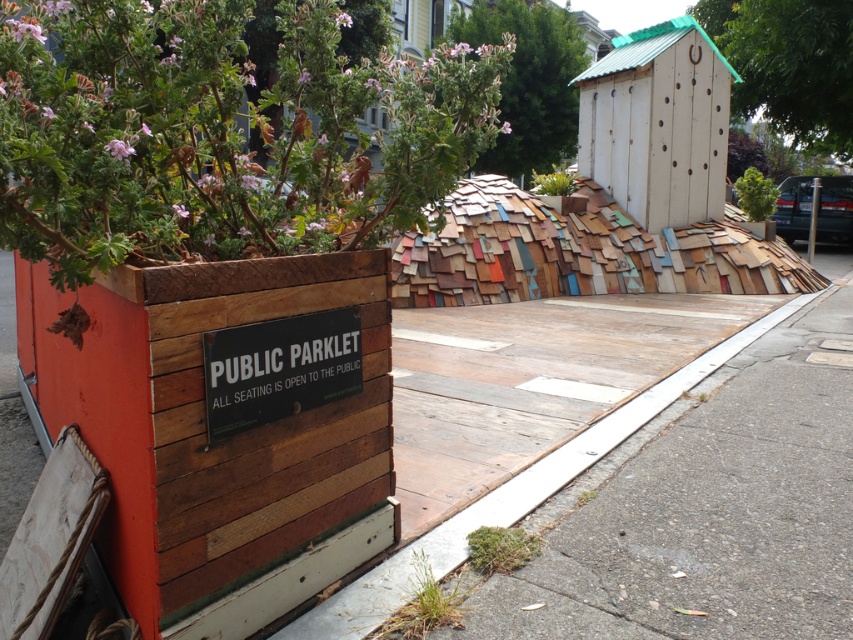
Question: Which object appears farthest from the camera in this image?

Choices:
 (A) pink wood flower at upper left
 (B) pink matte flower at upper left

Answer: (A)

Question: Which of the following is the closest to the observer?

Choices:
 (A) pink wood flower at upper left
 (B) green grass at lower center
 (C) pink petal at upper center

Answer: (B)

Question: Is green grass at lower center positioned at the back of green moss at lower center?

Choices:
 (A) yes
 (B) no

Answer: (B)

Question: Estimate the real-world distances between objects in this image. Which object is farther from the wooden planter at left?

Choices:
 (A) green moss at lower center
 (B) green grass at lower center
 (C) green leafy plant at upper right
 (D) pink wood flower at upper left

Answer: (C)

Question: Observing the image, what is the correct spatial positioning of green leafy plant at upper right in reference to pink matte flower at upper left?

Choices:
 (A) above
 (B) below

Answer: (A)

Question: Observing the image, what is the correct spatial positioning of wooden planter at left in reference to pink matte flower at upper left?

Choices:
 (A) left
 (B) right

Answer: (A)